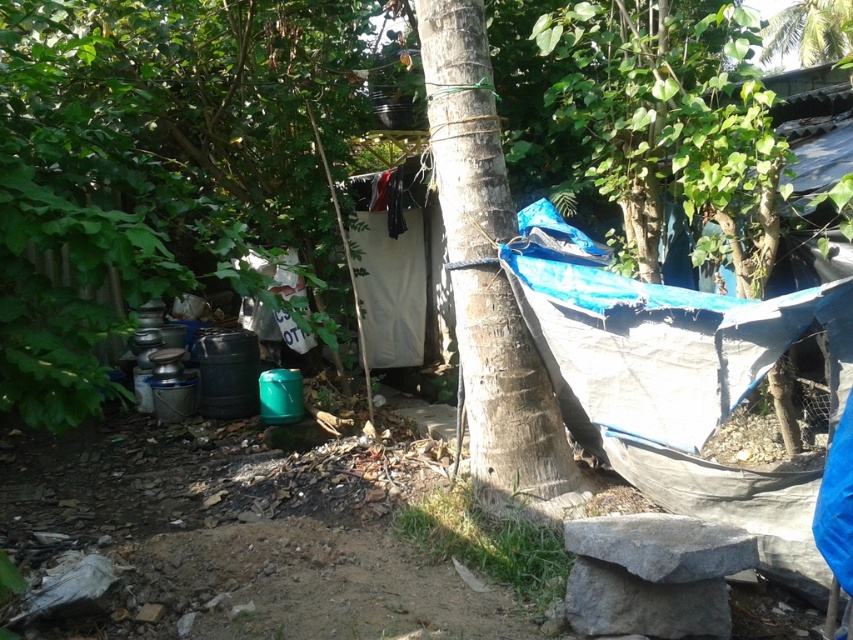
Which is in front, point (410, 221) or point (780, 56)?

Positioned in front is point (410, 221).

Between white fabric at center and green leafy tree at upper right, which one has less height?

green leafy tree at upper right is shorter.

Who is more distant from viewer, (415,362) or (770,52)?

Positioned behind is point (770,52).

Locate an element on the screen. white fabric at center is located at coordinates (390, 288).

Between blue tarp at center and green leafy tree at upper right, which one is positioned lower?

Positioned lower is blue tarp at center.

Measure the distance between blue tarp at center and camera.

blue tarp at center and camera are 1.78 meters apart.

Is point (666, 342) farther from viewer compared to point (842, 35)?

That is False.

This screenshot has width=853, height=640. Find the location of `blue tarp at center`. blue tarp at center is located at coordinates (675, 381).

Is rough bark tree at center smaller than white fabric at center?

No, rough bark tree at center is not smaller than white fabric at center.

What do you see at coordinates (489, 282) in the screenshot? I see `rough bark tree at center` at bounding box center [489, 282].

Identify the location of rough bark tree at center. (489, 282).